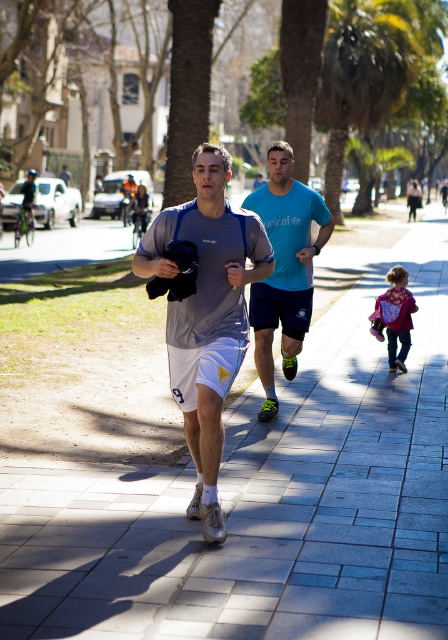
Is gray fabric shirt at center above blue t-shirt at center?

No.

Who is positioned more to the left, gray fabric shirt at center or blue t-shirt at center?

From the viewer's perspective, gray fabric shirt at center appears more on the left side.

Is point (184, 403) closer to viewer compared to point (266, 358)?

Yes.

Locate an element on the screen. Image resolution: width=448 pixels, height=640 pixels. gray fabric shirt at center is located at coordinates (206, 314).

Between point (52, 536) and point (344, 81), which one is positioned in front?

Positioned in front is point (52, 536).

Does point (426, 392) lie behind point (348, 8)?

No.

Between point (430, 218) and point (370, 42), which one is positioned in front?

Point (370, 42) is in front.

Locate an element on the screen. Image resolution: width=448 pixels, height=640 pixels. gray concrete pavement at center is located at coordinates (262, 502).

Looking at this image, does gray concrete pavement at center have a lesser height compared to velvet purple coat at center?

Incorrect, gray concrete pavement at center's height does not fall short of velvet purple coat at center's.

Consider the image. Is gray concrete pavement at center smaller than velvet purple coat at center?

Incorrect, gray concrete pavement at center is not smaller in size than velvet purple coat at center.

Based on the photo, who is more forward, (x=39, y=588) or (x=396, y=269)?

Point (x=39, y=588) is in front.

Where is `gray concrete pavement at center`? gray concrete pavement at center is located at coordinates (262, 502).